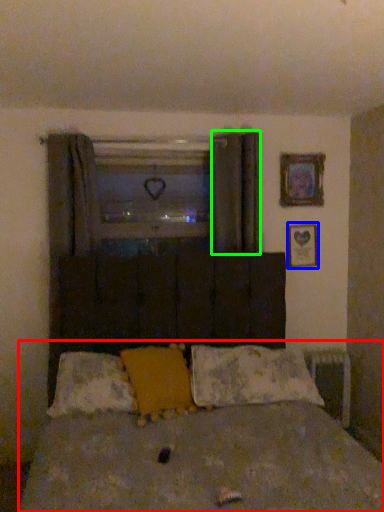
Question: Which object is the farthest from bed (highlighted by a red box)? Choose among these: picture frame (highlighted by a blue box) or curtain (highlighted by a green box).

Choices:
 (A) picture frame
 (B) curtain

Answer: (A)